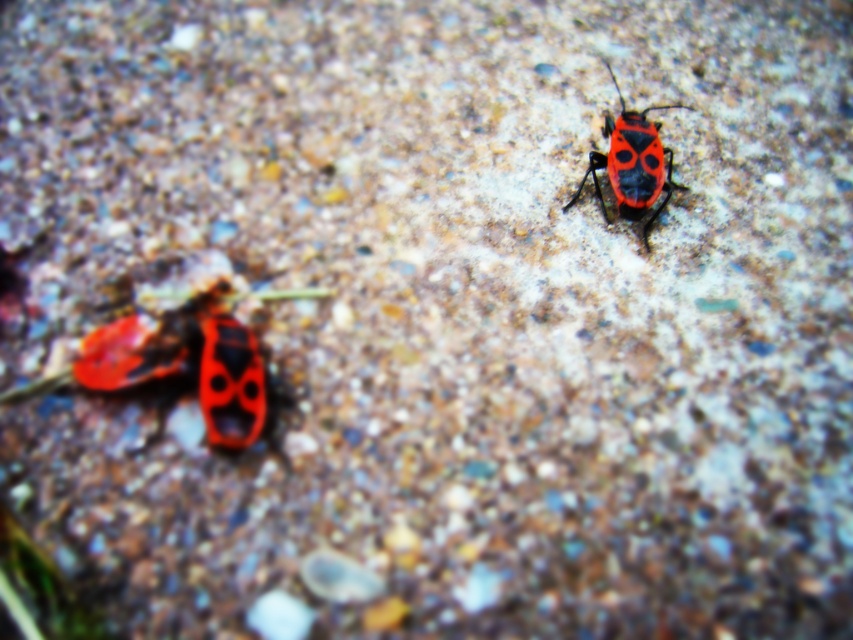
Does shiny red beetle at left have a lesser height compared to shiny red beetle at upper right?

Yes.

How far apart are shiny red beetle at left and shiny red beetle at upper right?

shiny red beetle at left is 55.64 centimeters from shiny red beetle at upper right.

Which is behind, point (177, 353) or point (654, 157)?

Point (654, 157)

Locate an element on the screen. shiny red beetle at left is located at coordinates (184, 358).